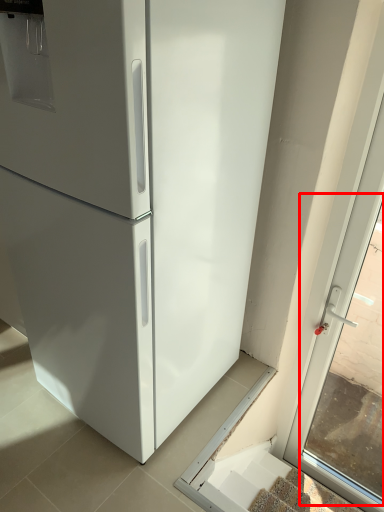
Question: Considering the relative positions of window (annotated by the red box) and stairs in the image provided, where is window (annotated by the red box) located with respect to the staircase?

Choices:
 (A) right
 (B) left

Answer: (A)